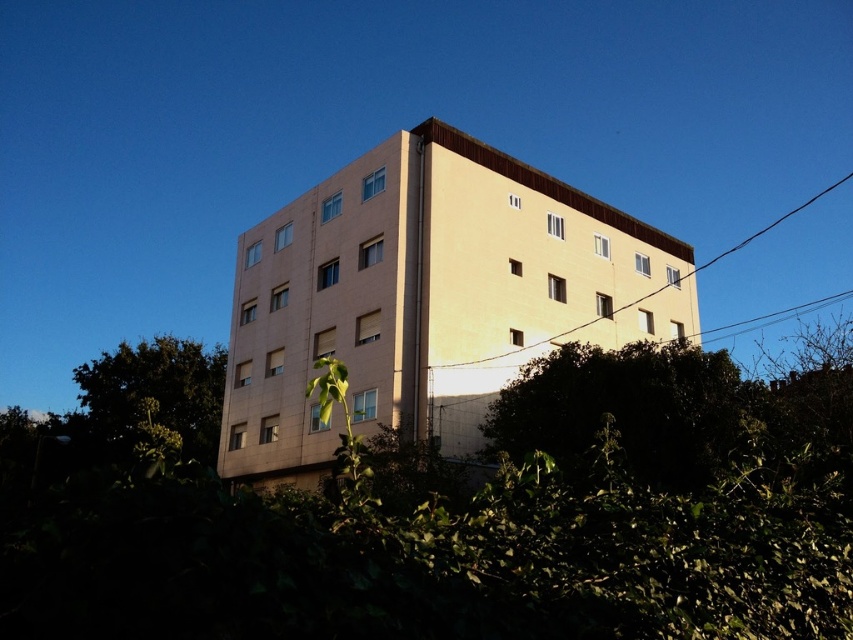
Question: Can you confirm if green leafy hedge at lower center is smaller than tan smooth building at center?

Choices:
 (A) yes
 (B) no

Answer: (B)

Question: Which object is closer to the camera taking this photo?

Choices:
 (A) tan smooth building at center
 (B) green leafy hedge at lower center

Answer: (B)

Question: Does green leafy hedge at lower center lie behind tan smooth building at center?

Choices:
 (A) yes
 (B) no

Answer: (B)

Question: Which of the following is the farthest from the observer?

Choices:
 (A) (248, 337)
 (B) (323, 595)

Answer: (A)

Question: Can you confirm if green leafy hedge at lower center is wider than tan smooth building at center?

Choices:
 (A) yes
 (B) no

Answer: (A)

Question: Which point is closer to the camera?

Choices:
 (A) green leafy hedge at lower center
 (B) tan smooth building at center

Answer: (A)